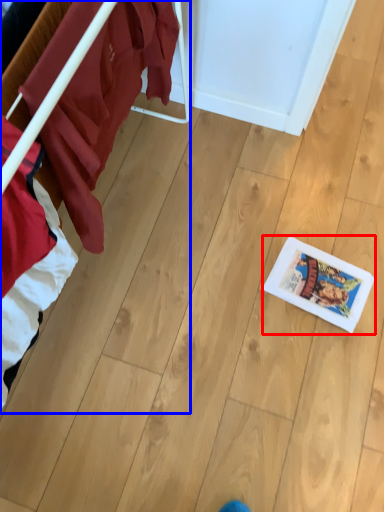
Question: Which object is closer to the camera taking this photo, comic book (highlighted by a red box) or furniture (highlighted by a blue box)?

Choices:
 (A) comic book
 (B) furniture

Answer: (B)